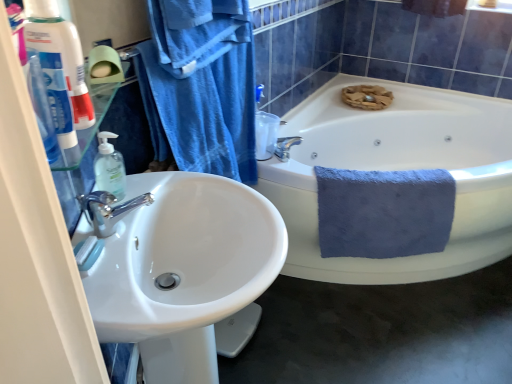
Locate an element on the screen. blank space situated above blue cotton towel at upper left, the 2th bath towel viewed from the back (from a real-world perspective) is located at coordinates (180, 29).